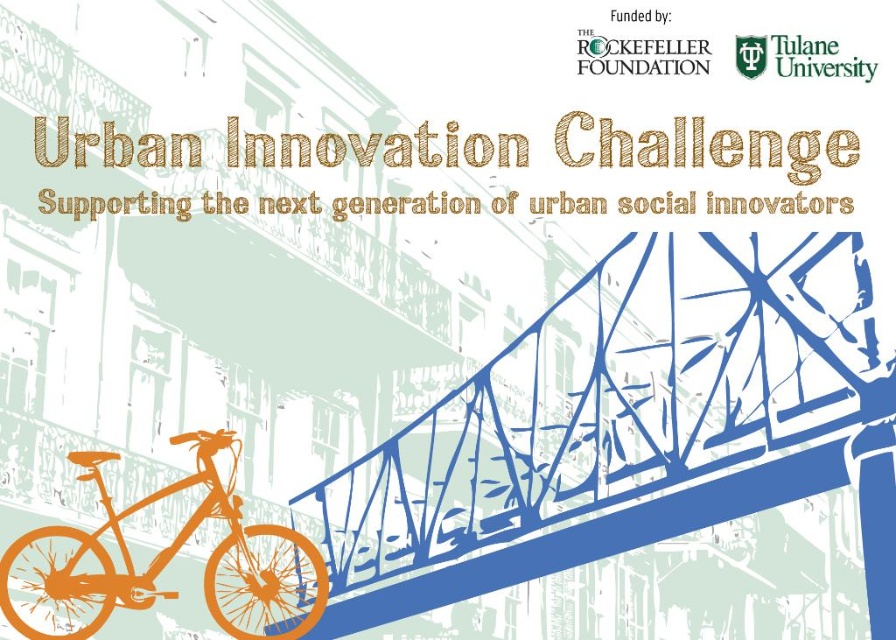
Question: Can you confirm if blue steel pedestrian bridge at center is thinner than orange matte bicycle at lower left?

Choices:
 (A) no
 (B) yes

Answer: (A)

Question: Is blue steel pedestrian bridge at center to the right of orange matte bicycle at lower left from the viewer's perspective?

Choices:
 (A) no
 (B) yes

Answer: (B)

Question: Among these objects, which one is farthest from the camera?

Choices:
 (A) orange matte bicycle at lower left
 (B) blue steel pedestrian bridge at center

Answer: (B)

Question: Is blue steel pedestrian bridge at center further to camera compared to orange matte bicycle at lower left?

Choices:
 (A) no
 (B) yes

Answer: (B)

Question: Which of the following is the closest to the observer?

Choices:
 (A) orange matte bicycle at lower left
 (B) blue steel pedestrian bridge at center

Answer: (A)